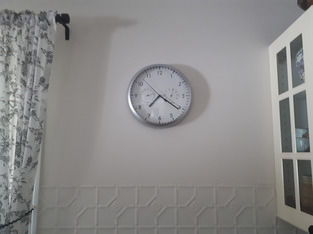
Locate an element on the screen. This screenshot has width=313, height=234. pattern on the wall is located at coordinates (74, 213), (127, 207), (174, 208), (221, 210).